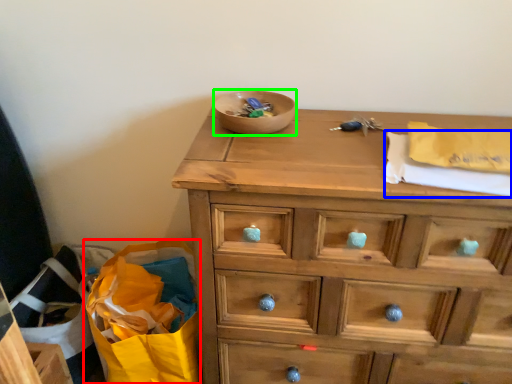
Question: Which is farther away from shopping bag (highlighted by a red box)? clothe (highlighted by a blue box) or bowl (highlighted by a green box)?

Choices:
 (A) clothe
 (B) bowl

Answer: (A)